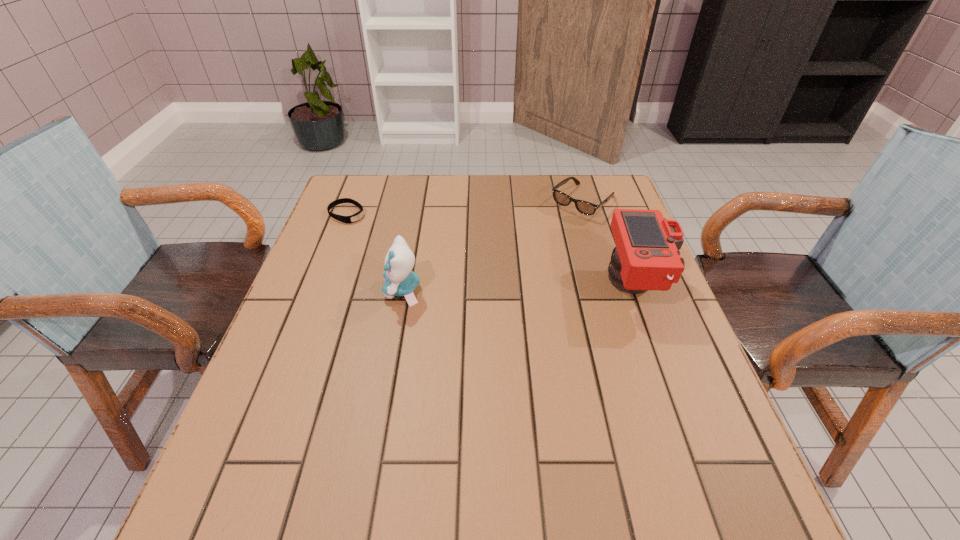
I want to click on object that is at the far left corner, so click(x=357, y=216).

Where is `object at the far right corner`? object at the far right corner is located at coordinates (584, 207).

At what (x,y) coordinates should I click in order to perform the action: click on free location at the far edge of the desktop. Please return your answer as a coordinate pair (x, y). Looking at the image, I should click on (472, 192).

In the image, there is a desktop. Identify the location of vacant area at the near edge. (501, 423).

Locate an element on the screen. vacant region at the left edge of the desktop is located at coordinates (297, 322).

Locate an element on the screen. blank area at the right edge is located at coordinates (657, 299).

In the image, there is a desktop. Identify the location of vacant region at the far left corner. (380, 188).

Where is `blank space at the far right corner of the desktop`? blank space at the far right corner of the desktop is located at coordinates (600, 188).

I want to click on vacant area that lies between the leftmost object and the spectacles, so click(465, 208).

The width and height of the screenshot is (960, 540). I want to click on free area in between the third tallest object and the camera, so click(610, 244).